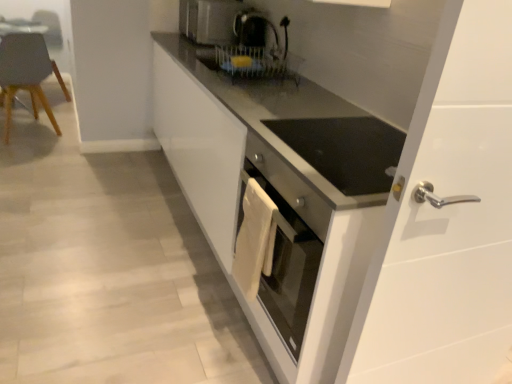
Where is `vacant area situated to the left side of white glossy cabinet at center`? This screenshot has width=512, height=384. vacant area situated to the left side of white glossy cabinet at center is located at coordinates (101, 210).